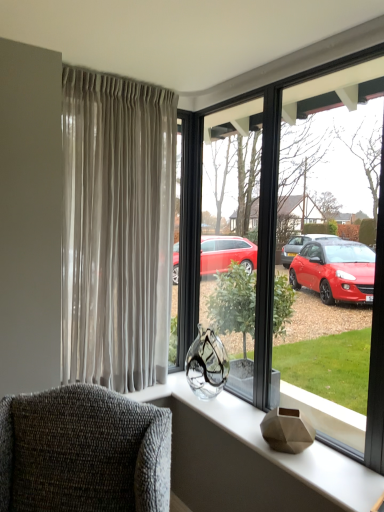
Question: Is textured gray armchair at lower left bigger or smaller than satin beige curtains at left?

Choices:
 (A) big
 (B) small

Answer: (A)

Question: Is point (117, 473) positioned closer to the camera than point (72, 102)?

Choices:
 (A) closer
 (B) farther

Answer: (A)

Question: Considering the real-world distances, which object is closest to the satin beige curtains at left?

Choices:
 (A) textured gray armchair at lower left
 (B) transparent glass vase at center
 (C) matte gray vase at center

Answer: (B)

Question: Which of these objects is positioned farthest from the textured gray armchair at lower left?

Choices:
 (A) matte gray vase at center
 (B) transparent glass vase at center
 (C) satin beige curtains at left

Answer: (B)